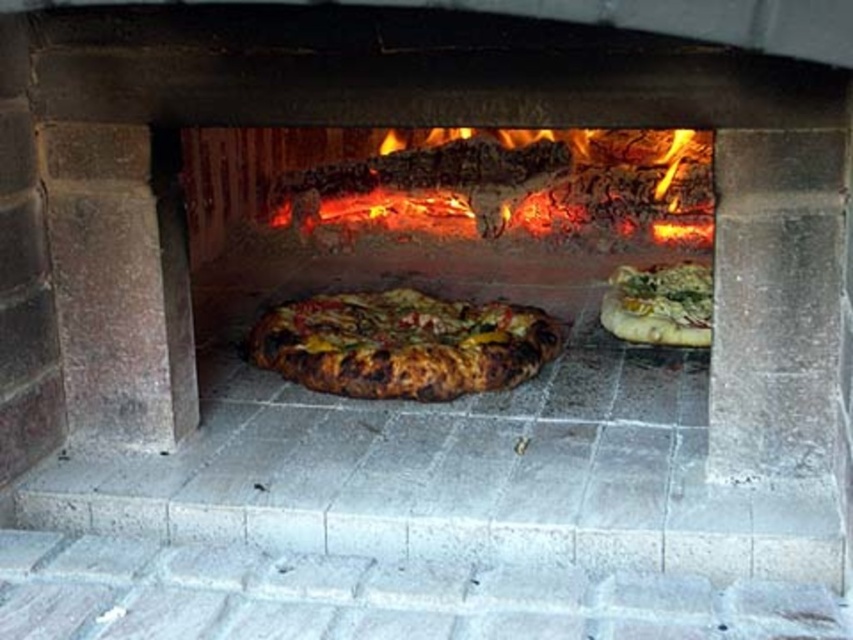
Can you confirm if golden-brown crusty pizza at center is wider than golden-brown crusty pizza at right?

Indeed, golden-brown crusty pizza at center has a greater width compared to golden-brown crusty pizza at right.

Between golden-brown crusty pizza at center and golden-brown crusty pizza at right, which one is positioned higher?

golden-brown crusty pizza at right

Identify the location of golden-brown crusty pizza at center. This screenshot has height=640, width=853. (x=402, y=342).

At what (x,y) coordinates should I click in order to perform the action: click on golden-brown crusty pizza at center. Please return your answer as a coordinate pair (x, y). Looking at the image, I should click on (402, 342).

Is point (595, 172) positioned in front of point (473, 316)?

No, it is not.

Which is more to the left, charcoal-like wood at center or golden-brown crusty pizza at center?

golden-brown crusty pizza at center is more to the left.

Image resolution: width=853 pixels, height=640 pixels. Identify the location of charcoal-like wood at center. coord(512,182).

Can you confirm if charcoal-like wood at center is positioned above golden-brown crusty pizza at right?

Yes, charcoal-like wood at center is above golden-brown crusty pizza at right.

Is point (285, 205) positioned after point (695, 275)?

Yes, it is.

Which is in front, point (639, 164) or point (643, 310)?

Positioned in front is point (643, 310).

Where is `charcoal-like wood at center`? Image resolution: width=853 pixels, height=640 pixels. charcoal-like wood at center is located at coordinates (512, 182).